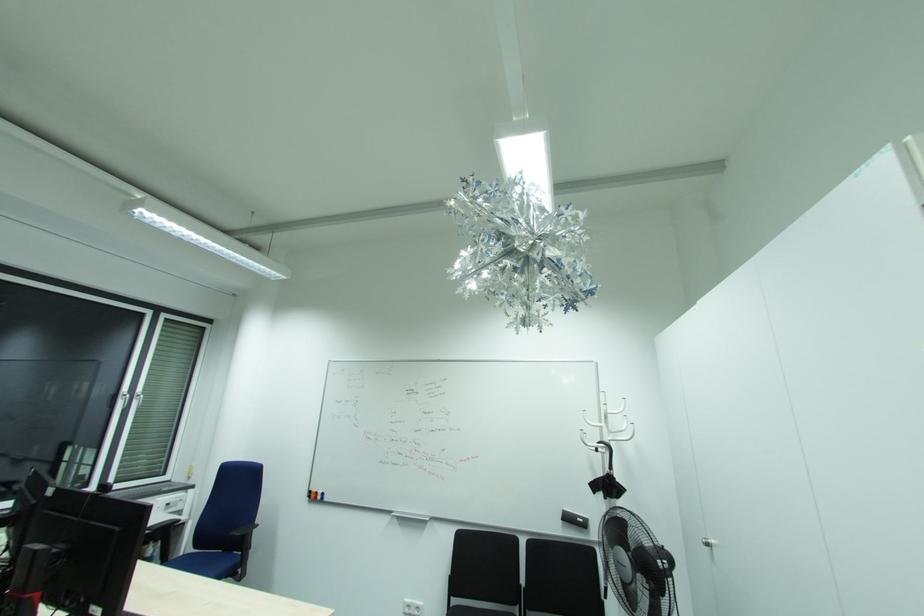
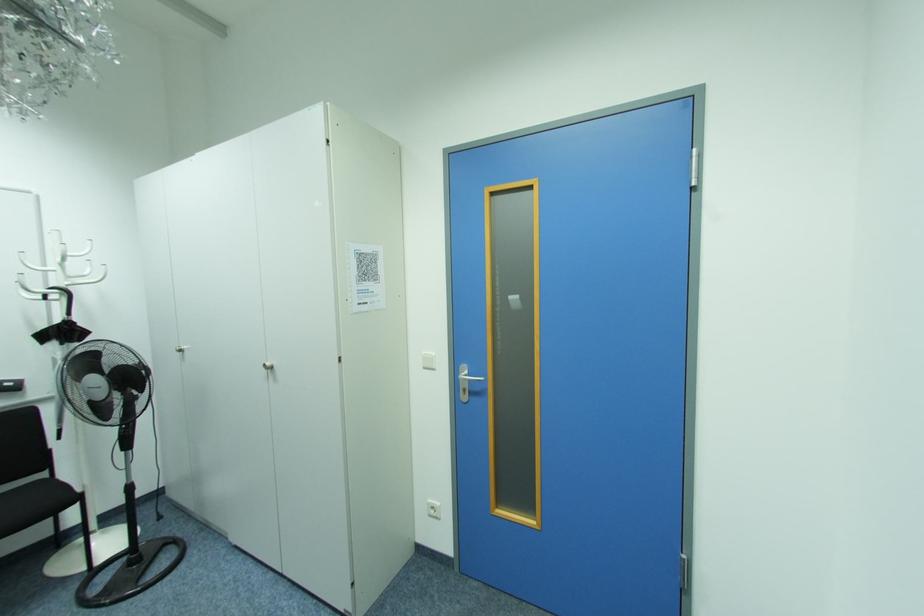
Question: The camera is either moving clockwise (left) or counter-clockwise (right) around the object. The first image is from the beginning of the video and the second image is from the end. Is the camera moving left or right when shooting the video?

Choices:
 (A) Left
 (B) Right

Answer: (A)